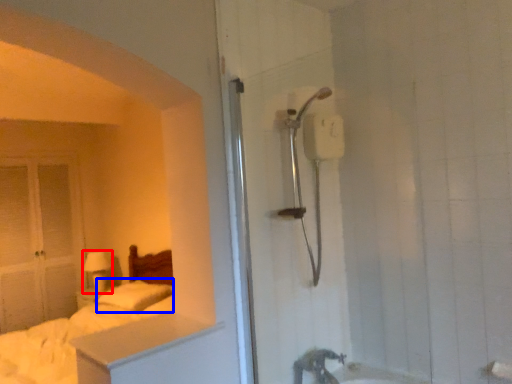
Question: Among these objects, which one is farthest to the camera, lamp (highlighted by a red box) or pillow (highlighted by a blue box)?

Choices:
 (A) lamp
 (B) pillow

Answer: (A)